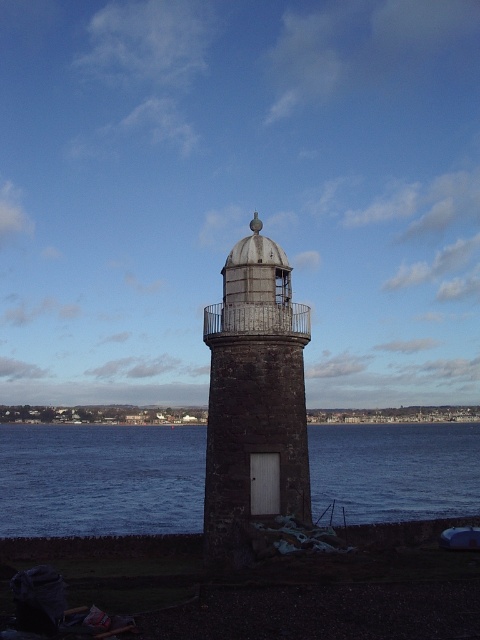
Question: Does blue water at center have a smaller size compared to dark gray stone tower at center?

Choices:
 (A) yes
 (B) no

Answer: (B)

Question: Where is blue water at center located in relation to dark gray stone tower at center in the image?

Choices:
 (A) above
 (B) below

Answer: (B)

Question: Which of the following is the farthest from the observer?

Choices:
 (A) (160, 524)
 (B) (230, 436)

Answer: (A)

Question: Can you confirm if blue water at center is wider than dark gray stone tower at center?

Choices:
 (A) yes
 (B) no

Answer: (A)

Question: Among these points, which one is nearest to the camera?

Choices:
 (A) (254, 285)
 (B) (92, 461)

Answer: (A)